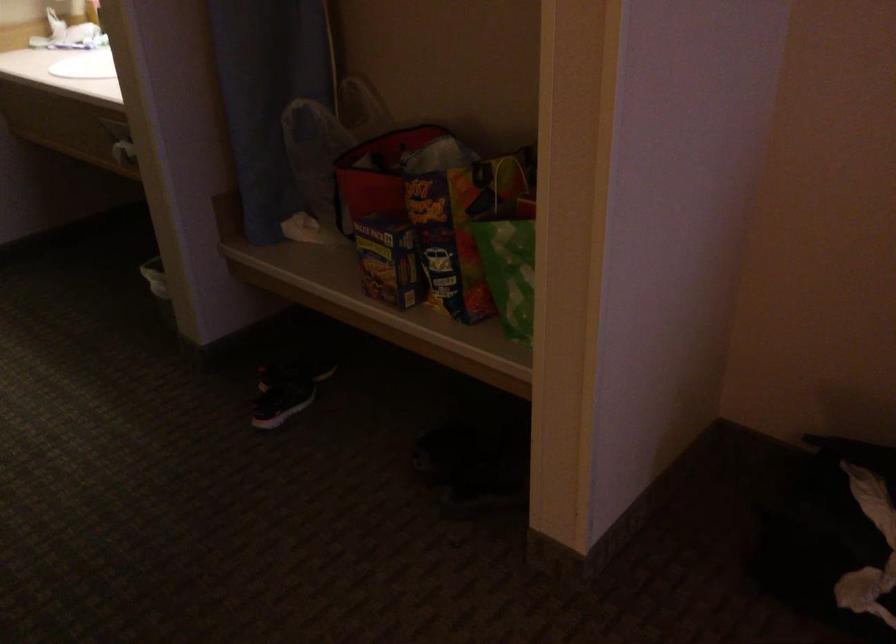
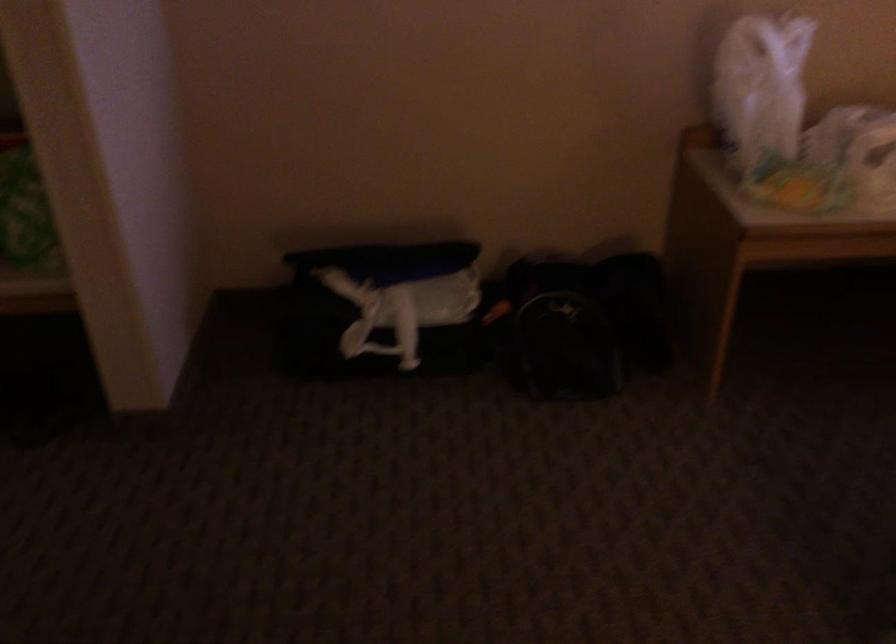
Question: The camera is either moving clockwise (left) or counter-clockwise (right) around the object. The first image is from the beginning of the video and the second image is from the end. Is the camera moving left or right when shooting the video?

Choices:
 (A) Left
 (B) Right

Answer: (A)